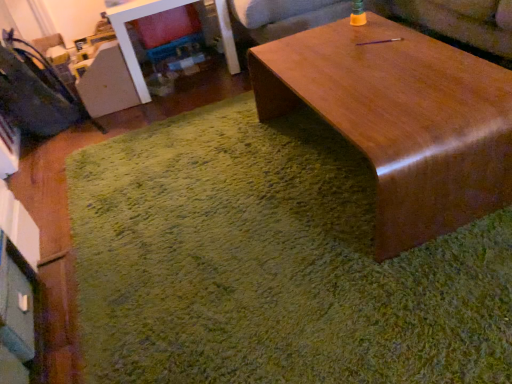
Question: In the image, is velvet dark blue swivel chair at left on the left side or the right side of glossy wood coffee table at center?

Choices:
 (A) left
 (B) right

Answer: (A)

Question: From a real-world perspective, is velvet dark blue swivel chair at left positioned above or below glossy wood coffee table at center?

Choices:
 (A) below
 (B) above

Answer: (B)

Question: Based on their relative distances, which object is nearer to the wooden couch at upper center?

Choices:
 (A) green shaggy rug at center
 (B) glossy wood coffee table at center
 (C) velvet dark blue swivel chair at left

Answer: (B)

Question: Which object is positioned farthest from the glossy wood coffee table at center?

Choices:
 (A) green shaggy rug at center
 (B) wooden couch at upper center
 (C) velvet dark blue swivel chair at left

Answer: (C)